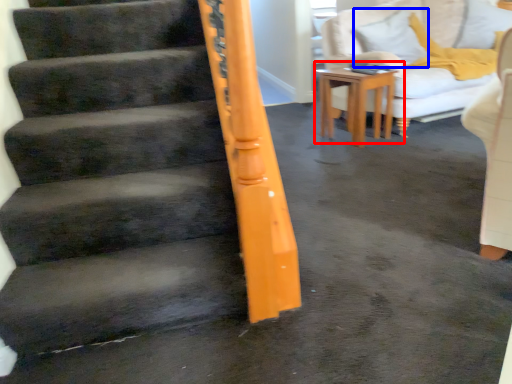
Question: Among these objects, which one is farthest to the camera, table (highlighted by a red box) or pillow (highlighted by a blue box)?

Choices:
 (A) table
 (B) pillow

Answer: (B)